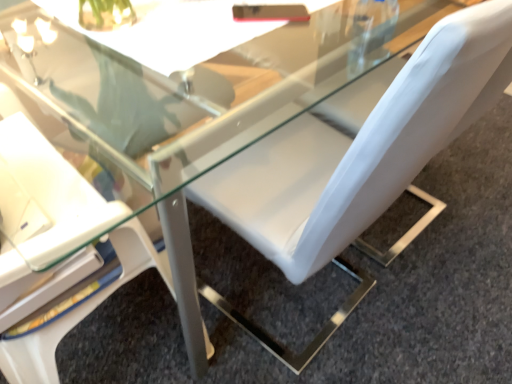
Question: Which direction should I rotate to face white leather chair at center, acting as the 1th chair starting from the right, — up or down?

Choices:
 (A) down
 (B) up

Answer: (B)

Question: From a real-world perspective, is white leather chair at center, the 2th chair when ordered from left to right, over white leather chair at upper right, which appears as the 2th chair when viewed from the right?

Choices:
 (A) yes
 (B) no

Answer: (A)

Question: Are white leather chair at center, acting as the 1th chair starting from the right, and white leather chair at upper right, the first chair from the left, far apart?

Choices:
 (A) yes
 (B) no

Answer: (B)

Question: Considering the relative sizes of white leather chair at center, acting as the 1th chair starting from the right, and white leather chair at upper right, the first chair from the left, in the image provided, is white leather chair at center, acting as the 1th chair starting from the right, taller than white leather chair at upper right, the first chair from the left,?

Choices:
 (A) yes
 (B) no

Answer: (A)

Question: Would you say white leather chair at center, acting as the 1th chair starting from the right, contains white leather chair at upper right, which appears as the 2th chair when viewed from the right?

Choices:
 (A) no
 (B) yes

Answer: (A)

Question: Is white leather chair at center, acting as the 1th chair starting from the right, wider than white leather chair at upper right, the first chair from the left?

Choices:
 (A) no
 (B) yes

Answer: (B)

Question: From a real-world perspective, is white leather chair at center, acting as the 1th chair starting from the right, located beneath white leather chair at upper right, which appears as the 2th chair when viewed from the right?

Choices:
 (A) yes
 (B) no

Answer: (B)

Question: Does white leather chair at upper right, which appears as the 2th chair when viewed from the right, have a greater height compared to white leather chair at center, the 2th chair when ordered from left to right?

Choices:
 (A) yes
 (B) no

Answer: (B)

Question: Considering the relative sizes of white leather chair at upper right, the first chair from the left, and white leather chair at center, the 2th chair when ordered from left to right, in the image provided, is white leather chair at upper right, the first chair from the left, bigger than white leather chair at center, the 2th chair when ordered from left to right,?

Choices:
 (A) no
 (B) yes

Answer: (A)

Question: From a real-world perspective, is white leather chair at upper right, the first chair from the left, over white leather chair at center, the 2th chair when ordered from left to right?

Choices:
 (A) yes
 (B) no

Answer: (B)

Question: Is white leather chair at upper right, which appears as the 2th chair when viewed from the right, smaller than white leather chair at center, the 2th chair when ordered from left to right?

Choices:
 (A) no
 (B) yes

Answer: (B)

Question: From the image's perspective, does white leather chair at upper right, which appears as the 2th chair when viewed from the right, appear higher than white leather chair at center, acting as the 1th chair starting from the right?

Choices:
 (A) yes
 (B) no

Answer: (B)

Question: Can you confirm if white leather chair at upper right, which appears as the 2th chair when viewed from the right, is wider than white leather chair at center, the 2th chair when ordered from left to right?

Choices:
 (A) yes
 (B) no

Answer: (B)

Question: In terms of width, does white leather chair at upper right, which appears as the 2th chair when viewed from the right, look wider or thinner when compared to white leather chair at center, acting as the 1th chair starting from the right?

Choices:
 (A) thin
 (B) wide

Answer: (A)